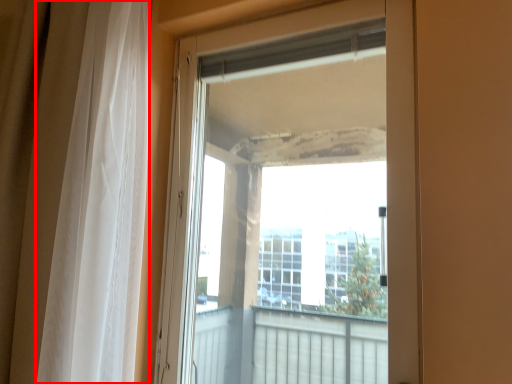
Question: From the image's perspective, considering the relative positions of curtain (annotated by the red box) and door in the image provided, where is curtain (annotated by the red box) located with respect to the staircase?

Choices:
 (A) below
 (B) above

Answer: (B)